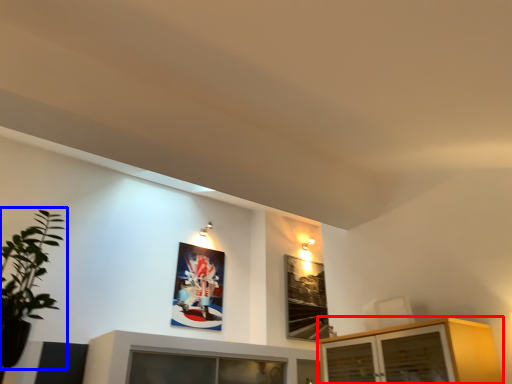
Question: Which point is closer to the camera, cabinetry (highlighted by a red box) or houseplant (highlighted by a blue box)?

Choices:
 (A) cabinetry
 (B) houseplant

Answer: (B)